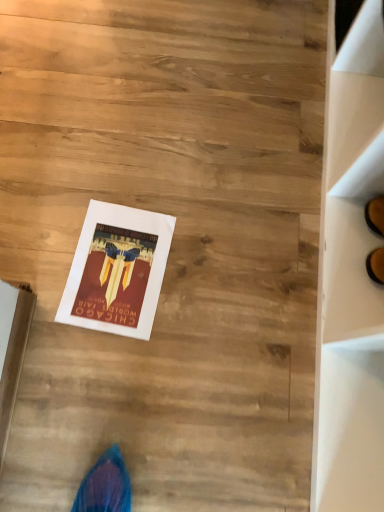
This screenshot has width=384, height=512. I want to click on free space in front of white cardboard box at lower left, so click(x=31, y=445).